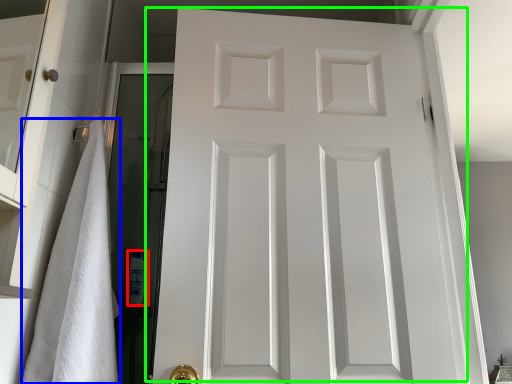
Question: Based on their relative distances, which object is farther from toiletry (highlighted by a red box)? Choose from bath towel (highlighted by a blue box) and door (highlighted by a green box).

Choices:
 (A) bath towel
 (B) door

Answer: (B)